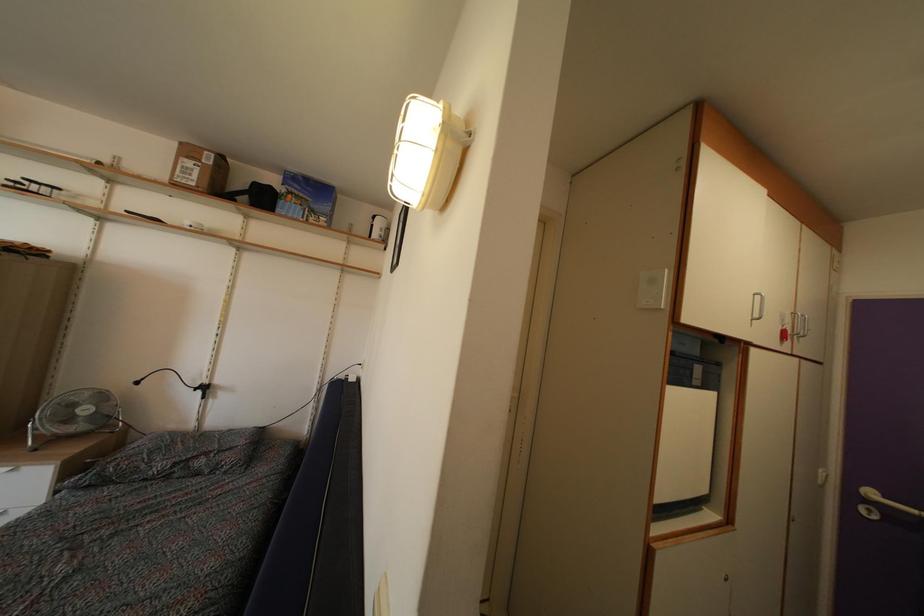
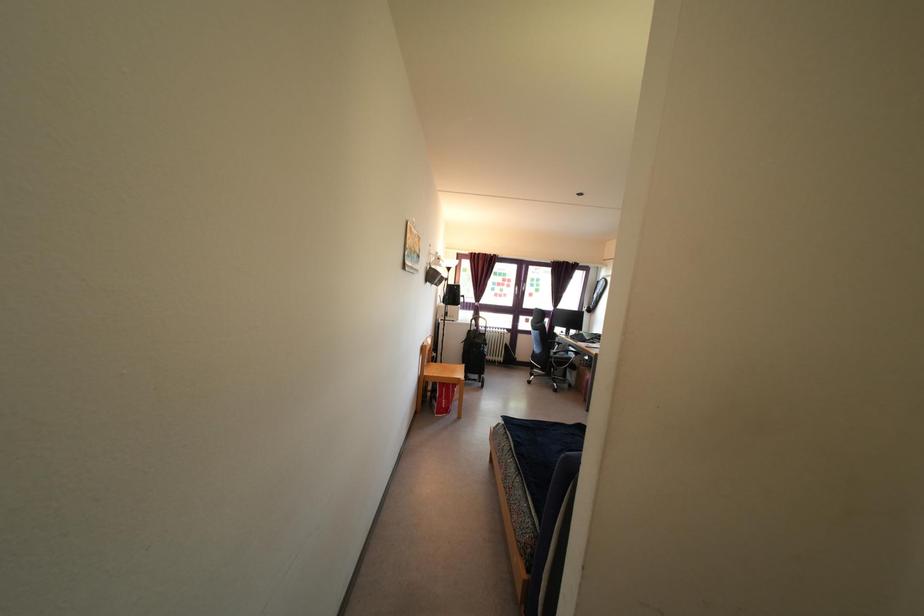
Question: The first image is from the beginning of the video and the second image is from the end. How did the camera likely rotate when shooting the video?

Choices:
 (A) Left
 (B) Right
 (C) Up
 (D) Down

Answer: (A)